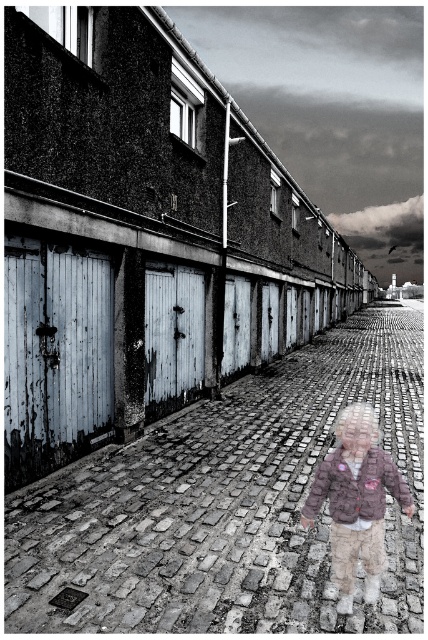
Can you confirm if brick pavement at center is positioned to the left of fluffy brown jacket at center?

In fact, brick pavement at center is to the right of fluffy brown jacket at center.

Is brick pavement at center closer to camera compared to fluffy brown jacket at center?

Yes.

Where is `brick pavement at center`? The image size is (428, 640). brick pavement at center is located at coordinates (228, 506).

This screenshot has width=428, height=640. I want to click on brick pavement at center, so click(x=228, y=506).